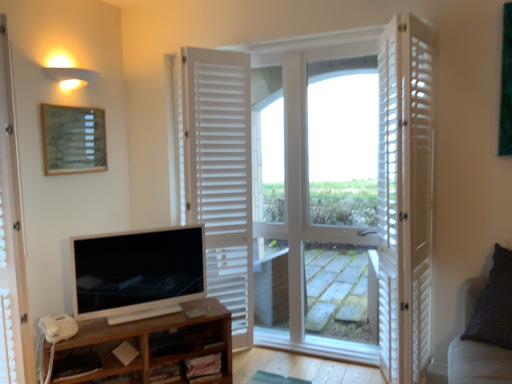
Question: Considering the relative sizes of matte wooden picture frame at upper left and white wooden door at right, the third door positioned from the left, in the image provided, is matte wooden picture frame at upper left wider than white wooden door at right, the third door positioned from the left,?

Choices:
 (A) no
 (B) yes

Answer: (A)

Question: From a real-world perspective, is matte wooden picture frame at upper left on top of white wooden door at right, the third door positioned from the left?

Choices:
 (A) no
 (B) yes

Answer: (B)

Question: Is matte wooden picture frame at upper left positioned with its back to white wooden door at right, which is the first door in right-to-left order?

Choices:
 (A) no
 (B) yes

Answer: (A)

Question: Is matte wooden picture frame at upper left positioned in front of white wooden door at right, which is the first door in right-to-left order?

Choices:
 (A) no
 (B) yes

Answer: (A)

Question: Is matte wooden picture frame at upper left shorter than white wooden door at right, the third door positioned from the left?

Choices:
 (A) yes
 (B) no

Answer: (A)

Question: Is matte wooden picture frame at upper left facing towards white wooden door at right, which is the first door in right-to-left order?

Choices:
 (A) yes
 (B) no

Answer: (A)

Question: Can you confirm if brown wood shelf at lower left is taller than dark gray fabric couch at right?

Choices:
 (A) no
 (B) yes

Answer: (A)

Question: Is brown wood shelf at lower left not near dark gray fabric couch at right?

Choices:
 (A) no
 (B) yes

Answer: (B)

Question: Considering the relative positions of brown wood shelf at lower left and dark gray fabric couch at right in the image provided, is brown wood shelf at lower left to the right of dark gray fabric couch at right from the viewer's perspective?

Choices:
 (A) no
 (B) yes

Answer: (A)

Question: Does brown wood shelf at lower left have a greater width compared to dark gray fabric couch at right?

Choices:
 (A) yes
 (B) no

Answer: (B)

Question: From the image's perspective, is brown wood shelf at lower left on dark gray fabric couch at right?

Choices:
 (A) yes
 (B) no

Answer: (B)

Question: Is dark gray fabric couch at right at the back of brown wood shelf at lower left?

Choices:
 (A) no
 (B) yes

Answer: (A)

Question: From the image's perspective, is white wooden door at center, the first door in the left-to-right sequence, above brown wood shelf at lower left?

Choices:
 (A) yes
 (B) no

Answer: (A)